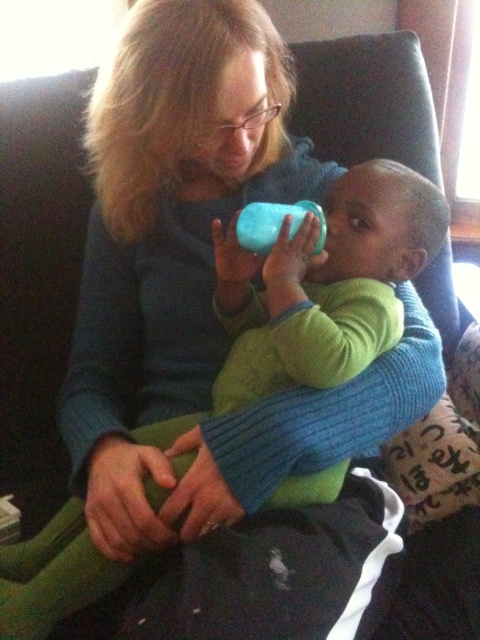
Does point (368, 282) come closer to viewer compared to point (294, 225)?

That is False.

Describe the element at coordinates (324, 285) in the screenshot. The width and height of the screenshot is (480, 640). I see `green soft baby at center` at that location.

Locate an element on the screen. green soft baby at center is located at coordinates 324,285.